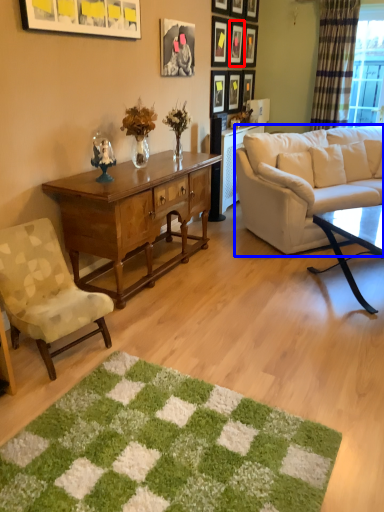
Question: Which object appears farthest to the camera in this image, picture frame (highlighted by a red box) or studio couch (highlighted by a blue box)?

Choices:
 (A) picture frame
 (B) studio couch

Answer: (A)